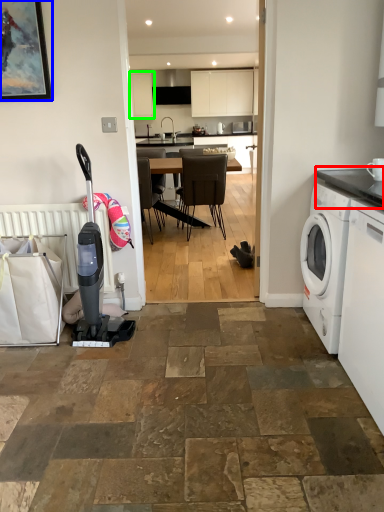
Question: Estimate the real-world distances between objects in this image. Which object is closer to countertop (highlighted by a red box), picture frame (highlighted by a blue box) or cabinetry (highlighted by a green box)?

Choices:
 (A) picture frame
 (B) cabinetry

Answer: (A)